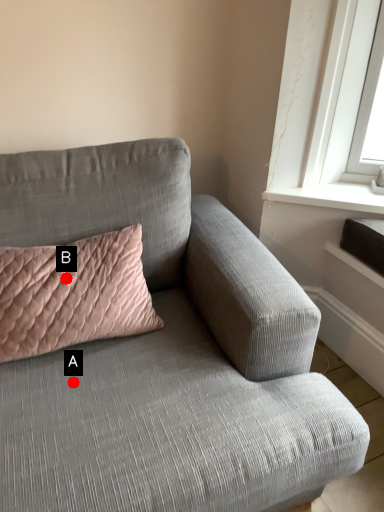
Question: Two points are circled on the image, labeled by A and B beside each circle. Among these points, which one is nearest to the camera?

Choices:
 (A) A is closer
 (B) B is closer

Answer: (A)